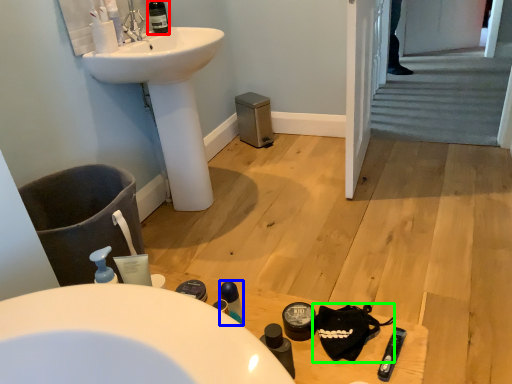
Question: Which is farther away from wine bottle (highlighted by a red box)? mouthwash (highlighted by a blue box) or accessory (highlighted by a green box)?

Choices:
 (A) mouthwash
 (B) accessory

Answer: (B)